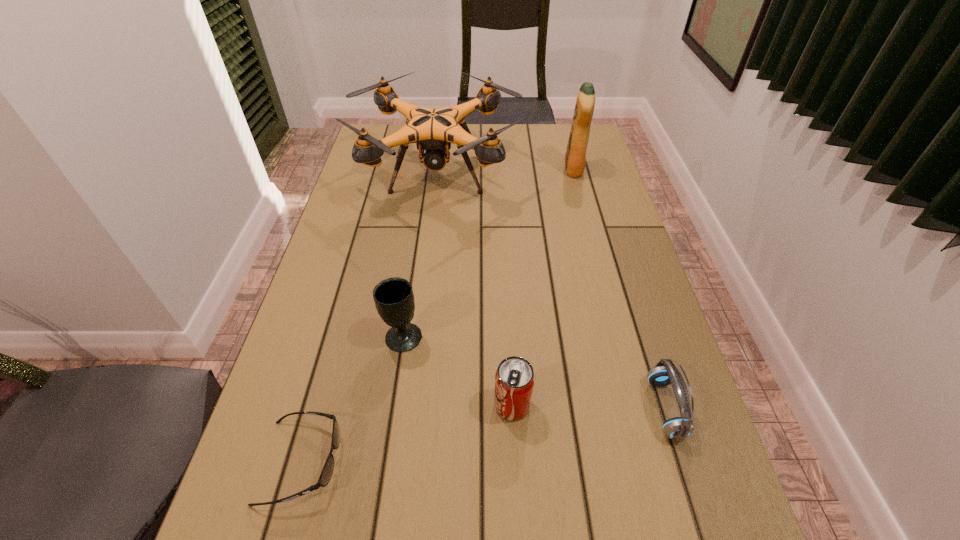
At what (x,y) coordinates should I click in order to perform the action: click on vacant space located on the camera mount of the drone. Please return your answer as a coordinate pair (x, y). This screenshot has width=960, height=540. Looking at the image, I should click on (428, 250).

Locate an element on the screen. blank space located on the back of the chalice is located at coordinates (420, 219).

This screenshot has width=960, height=540. What are the coordinates of `blank area located 0.350m on the back of the pop soda` in the screenshot? It's located at (505, 268).

You are a GUI agent. You are given a task and a screenshot of the screen. Output one action in this format:
    pyautogui.click(x=<x>, y=<y>)
    Task: Click on the vacant space situated 0.210m on the ear cups of the headset
    This screenshot has height=540, width=960.
    Given the screenshot: What is the action you would take?
    545,408

At what (x,y) coordinates should I click in order to perform the action: click on free space located 0.060m on the ear cups of the headset. Please return your answer as a coordinate pair (x, y). The image size is (960, 540). Looking at the image, I should click on (621, 408).

You are a GUI agent. You are given a task and a screenshot of the screen. Output one action in this format:
    pyautogui.click(x=<x>, y=<y>)
    Task: Click on the free spot located 0.310m on the ear cups of the headset
    This screenshot has width=960, height=540.
    Given the screenshot: What is the action you would take?
    pyautogui.click(x=494, y=408)

Image resolution: width=960 pixels, height=540 pixels. In order to click on vacant space located 0.360m on the front-facing side of the sunglasses in this screenshot , I will do `click(539, 462)`.

Find the location of a particular element. This screenshot has width=960, height=540. object situated at the far edge is located at coordinates (433, 130).

The height and width of the screenshot is (540, 960). Identify the location of drone that is at the left edge. (433, 130).

You are a GUI agent. You are given a task and a screenshot of the screen. Output one action in this format:
    pyautogui.click(x=<x>, y=<y>)
    Task: Click on the sunglasses situated at the left edge
    
    Given the screenshot: What is the action you would take?
    pyautogui.click(x=326, y=474)